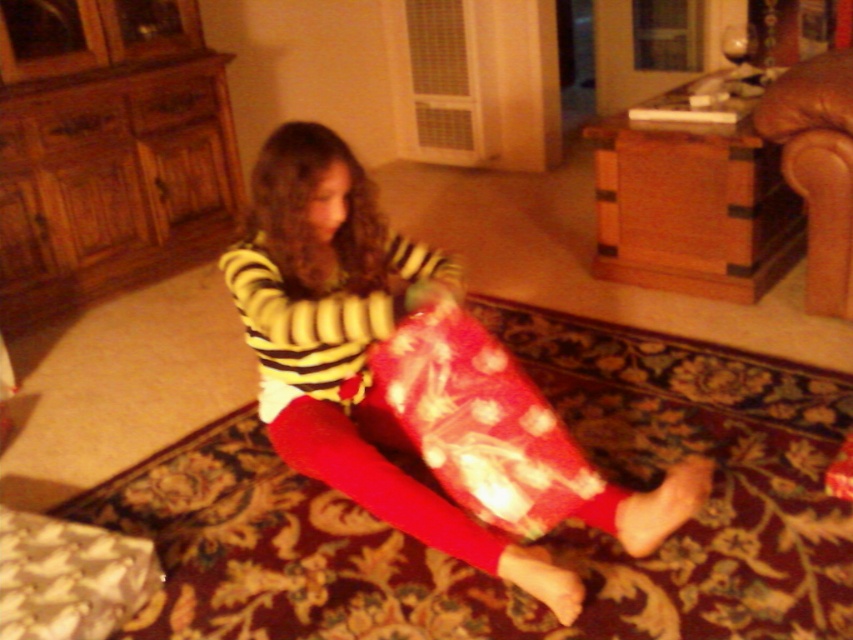
Can you confirm if shiny red wrapping paper at lower center is smaller than brown leather armchair at upper right?

Incorrect, shiny red wrapping paper at lower center is not smaller in size than brown leather armchair at upper right.

Is shiny red wrapping paper at lower center wider than brown leather armchair at upper right?

Yes.

What do you see at coordinates (480, 422) in the screenshot?
I see `shiny red wrapping paper at lower center` at bounding box center [480, 422].

Find the location of a particular element. shiny red wrapping paper at lower center is located at coordinates (480, 422).

Can you confirm if matte red leggings at center is positioned to the left of shiny red wrapping paper at lower center?

Correct, you'll find matte red leggings at center to the left of shiny red wrapping paper at lower center.

Can you confirm if matte red leggings at center is wider than shiny red wrapping paper at lower center?

Correct, the width of matte red leggings at center exceeds that of shiny red wrapping paper at lower center.

In order to click on matte red leggings at center in this screenshot , I will do `click(350, 346)`.

Where is `matte red leggings at center`? The width and height of the screenshot is (853, 640). matte red leggings at center is located at coordinates (350, 346).

Which of these two, matte red leggings at center or brown leather armchair at upper right, stands shorter?

brown leather armchair at upper right

Measure the distance between point [326,129] and camera.

Point [326,129] is 6.79 feet from camera.

At what (x,y) coordinates should I click in order to perform the action: click on matte red leggings at center. Please return your answer as a coordinate pair (x, y). Looking at the image, I should click on (350, 346).